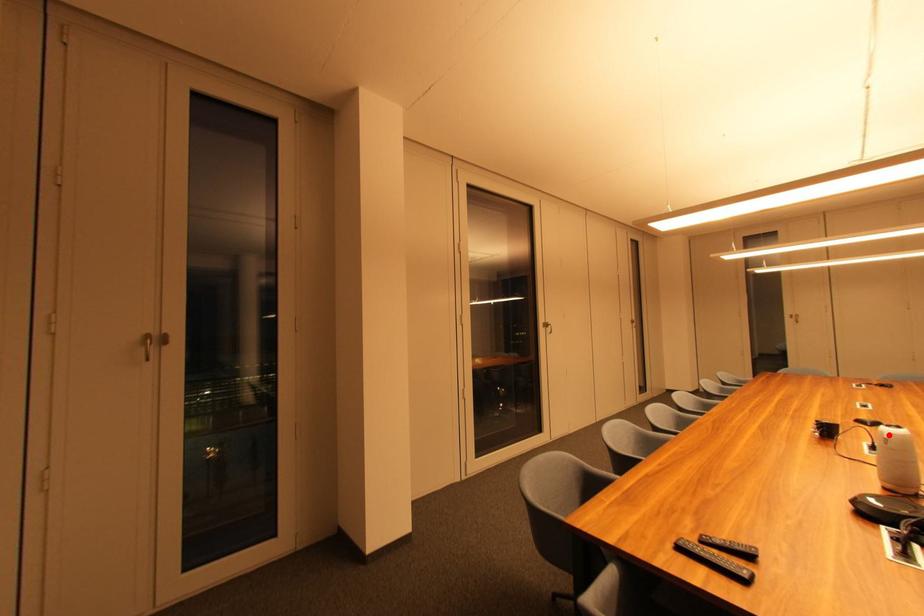
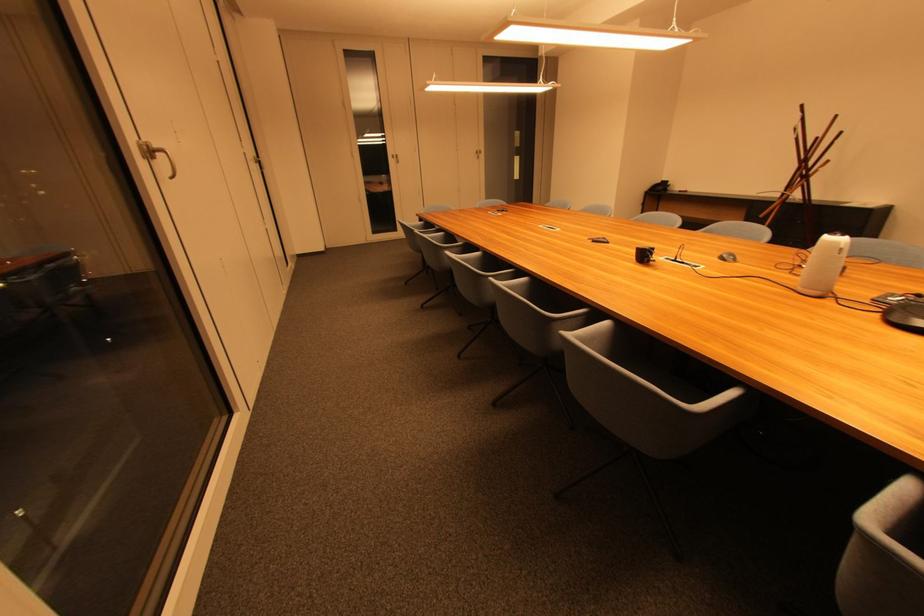
In the second image, find the point that corresponds to the highlighted location in the first image.

(841, 245)